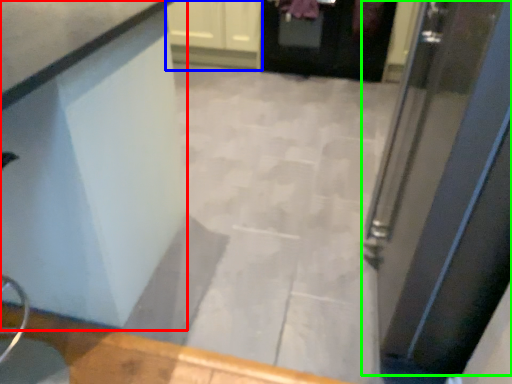
Question: Based on their relative distances, which object is nearer to counter (highlighted by a red box)? Choose from cabinetry (highlighted by a blue box) and door (highlighted by a green box).

Choices:
 (A) cabinetry
 (B) door

Answer: (B)